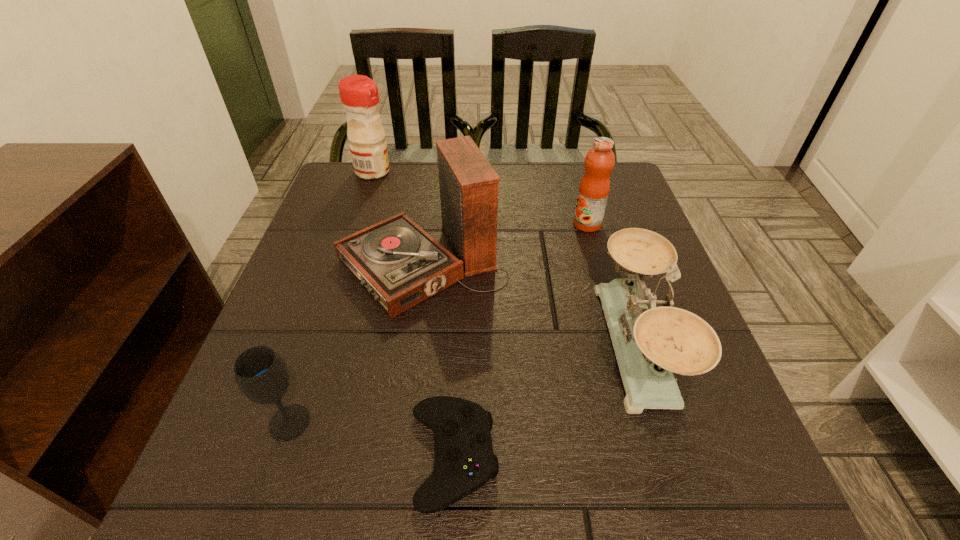
Identify the location of unoccupied position between the scale and the control. (545, 400).

This screenshot has height=540, width=960. In order to click on vacant space that is in between the fruit juice and the phonograph record in this screenshot , I will do `click(505, 245)`.

At what (x,y) coordinates should I click in order to perform the action: click on vacant space that is in between the control and the phonograph record. Please return your answer as a coordinate pair (x, y). This screenshot has width=960, height=540. Looking at the image, I should click on (438, 361).

Locate an element on the screen. The width and height of the screenshot is (960, 540). empty space that is in between the condiment and the wineglass is located at coordinates (331, 297).

Where is `empty space that is in between the second shortest object and the phonograph record`? The height and width of the screenshot is (540, 960). empty space that is in between the second shortest object and the phonograph record is located at coordinates [x=356, y=344].

Where is `vacant area that lies between the condiment and the wineglass`? vacant area that lies between the condiment and the wineglass is located at coordinates (331, 297).

Find the location of `vacant area that lies between the second shortest object and the shortest object`. vacant area that lies between the second shortest object and the shortest object is located at coordinates (372, 439).

In order to click on unoccupied position between the phonograph record and the scale in this screenshot , I will do `click(529, 305)`.

Locate an element on the screen. This screenshot has height=540, width=960. free space between the phonograph record and the scale is located at coordinates (529, 305).

Image resolution: width=960 pixels, height=540 pixels. I want to click on free space between the fruit juice and the control, so [x=520, y=340].